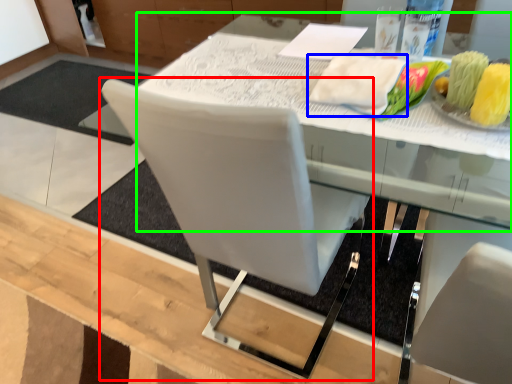
Question: Estimate the real-world distances between objects in this image. Which object is farther from chair (highlighted by a red box), cloth (highlighted by a blue box) or round table (highlighted by a green box)?

Choices:
 (A) cloth
 (B) round table

Answer: (A)